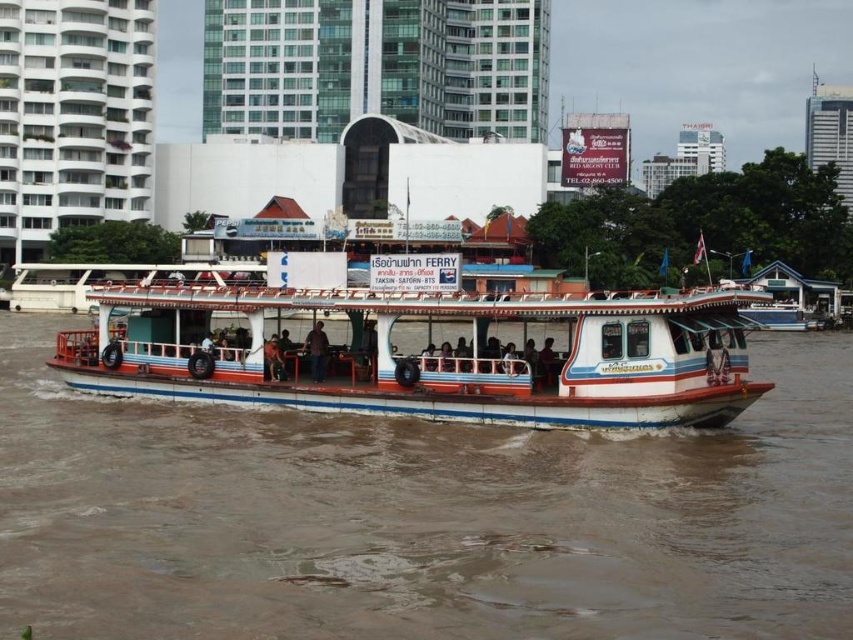
Does brown muddy water at center come behind white matte boat at center?

No, brown muddy water at center is closer to the viewer.

Where is `brown muddy water at center`? brown muddy water at center is located at coordinates (421, 516).

Does white matte boat at center lie in front of dark brown leather jacket at center?

That is True.

Does white matte boat at center have a greater width compared to dark brown leather jacket at center?

Yes, white matte boat at center is wider than dark brown leather jacket at center.

Identify the location of white matte boat at center. Image resolution: width=853 pixels, height=640 pixels. (428, 355).

Does brown muddy water at center have a smaller size compared to dark brown leather jacket at center?

No, brown muddy water at center is not smaller than dark brown leather jacket at center.

Who is more forward, (x=97, y=486) or (x=279, y=374)?

Point (x=97, y=486)

Is point (666, 456) closer to viewer compared to point (274, 362)?

Yes.

This screenshot has width=853, height=640. I want to click on brown muddy water at center, so click(421, 516).